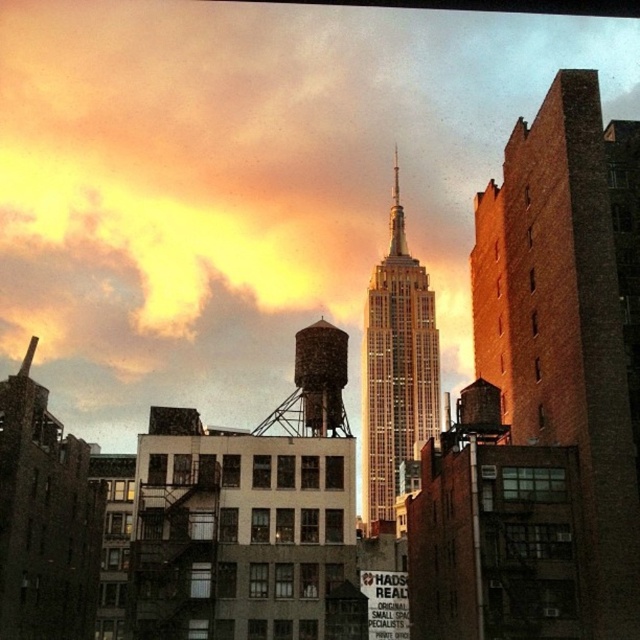
From the picture: You are an architect analyzing the urban layout of the scene. Based on the positioning of the gold glass skyscraper at center and the rustic metal water tower at center, which one is located to the right of the other?

The gold glass skyscraper at center is positioned on the right side of rustic metal water tower at center, so the skyscraper is to the right of the water tower.

You are standing on the sidewalk in front of the brick building at right and the rustic metal water tower at center. If you look upward, which object will you see first?

The brick building at right will be seen first because it is positioned above the rustic metal water tower at center.

You are an architect evaluating the urban skyline. Given the gold glass skyscraper at center and the rustic metal water tower at center, which structure would cast a longer shadow during sunset?

The gold glass skyscraper at center is taller than the rustic metal water tower at center, so it would cast a longer shadow during sunset.